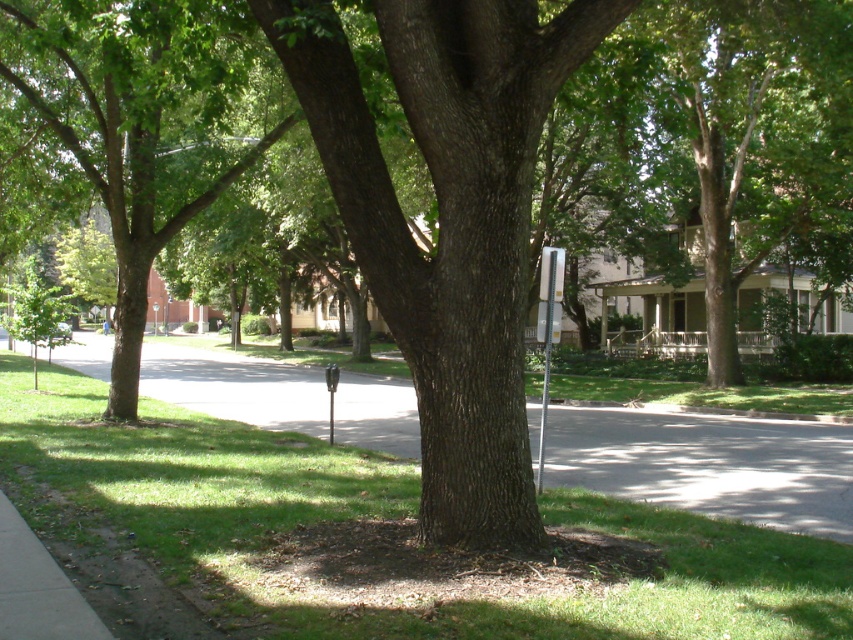
You are standing at the edge of the sidewalk and want to take a photo of the smooth brown tree trunk at center. If your camera can focus on objects up to 5 meters away, will you need to move closer or farther away to get a clear shot?

The smooth brown tree trunk at center is 5.07 meters away from the camera. Since your camera can focus up to 5 meters, you need to move slightly closer to ensure it is within the focus range.

You are a delivery driver who needs to park your car near the gray asphalt pavement at center and the metallic gray parking meter at center. According to the scene, which object is closer to the curb?

The metallic gray parking meter at center is closer to the curb because the gray asphalt pavement at center is to the left of it, meaning the parking meter is positioned closer to the curb side of the road.

You are a delivery person trying to park your bike. You see the gray asphalt pavement at center and the metallic gray parking meter at center. Which object is closer to you as you approach the scene?

The gray asphalt pavement at center is closer to you since it is in front of the metallic gray parking meter at center.